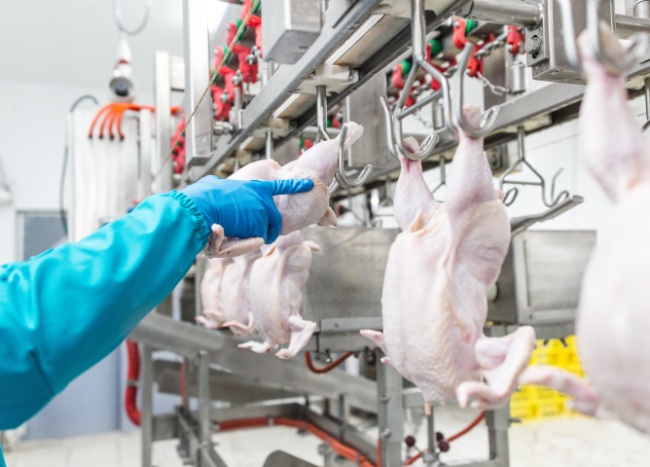
Where is `metal tray`? The width and height of the screenshot is (650, 467). metal tray is located at coordinates (361, 387).